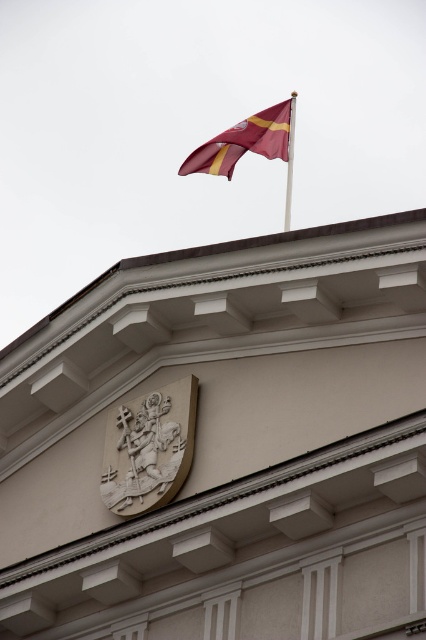
Question: Does maroon fabric flag at upper center appear on the right side of metallic flag pole at upper center?

Choices:
 (A) yes
 (B) no

Answer: (B)

Question: Does maroon fabric flag at upper center lie behind metallic flag pole at upper center?

Choices:
 (A) no
 (B) yes

Answer: (A)

Question: Which point is farther from the camera taking this photo?

Choices:
 (A) (288, 202)
 (B) (259, 125)

Answer: (A)

Question: Where is maroon fabric flag at upper center located in relation to metallic flag pole at upper center in the image?

Choices:
 (A) right
 (B) left

Answer: (B)

Question: Which point is closer to the camera?

Choices:
 (A) metallic flag pole at upper center
 (B) maroon fabric flag at upper center

Answer: (B)

Question: Which object appears closest to the camera in this image?

Choices:
 (A) maroon fabric flag at upper center
 (B) metallic flag pole at upper center

Answer: (A)